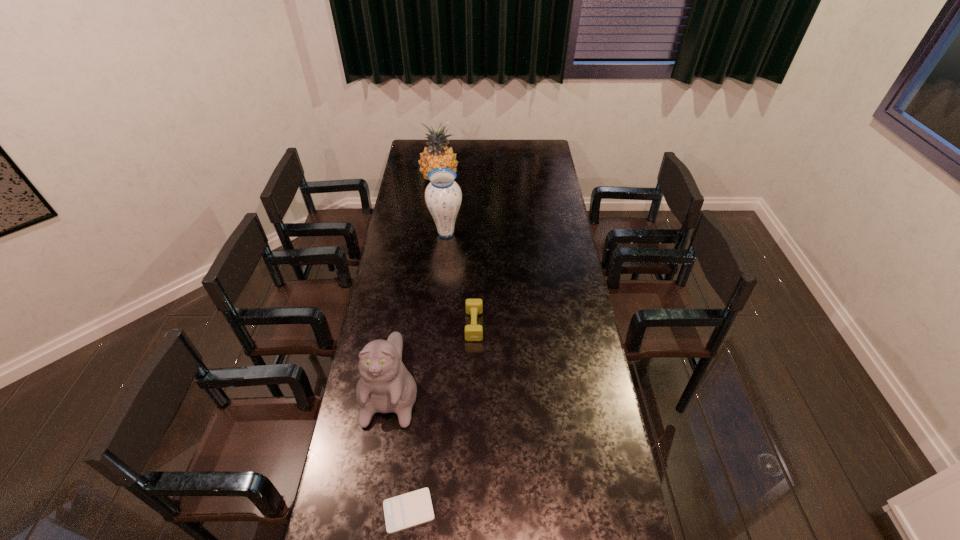
Find the location of a particular element. The image size is (960, 540). vacant space located on the left of the rightmost object is located at coordinates (381, 325).

Find the location of a particular element. free point located 0.270m on the right of the nearest object is located at coordinates (526, 510).

The image size is (960, 540). Find the location of `pineapple present at the left edge`. pineapple present at the left edge is located at coordinates (437, 155).

Locate an element on the screen. The width and height of the screenshot is (960, 540). cat located at the left edge is located at coordinates (385, 386).

Find the location of a particular element. The image size is (960, 540). calculator located at the left edge is located at coordinates (413, 508).

Identify the location of vacant region at the far edge of the desktop. Image resolution: width=960 pixels, height=540 pixels. (515, 156).

Locate an element on the screen. The width and height of the screenshot is (960, 540). vacant region at the left edge of the desktop is located at coordinates (392, 425).

Where is `free spot at the right edge of the desktop`? free spot at the right edge of the desktop is located at coordinates (585, 398).

Locate an element on the screen. This screenshot has height=540, width=960. vacant space at the far left corner of the desktop is located at coordinates click(411, 153).

Locate an element on the screen. vacant space at the far right corner of the desktop is located at coordinates (540, 154).